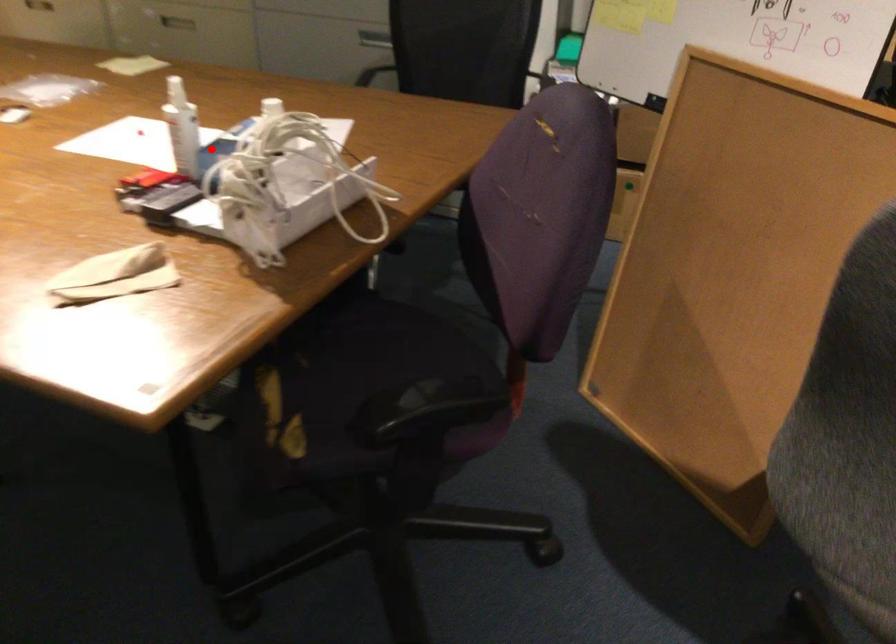
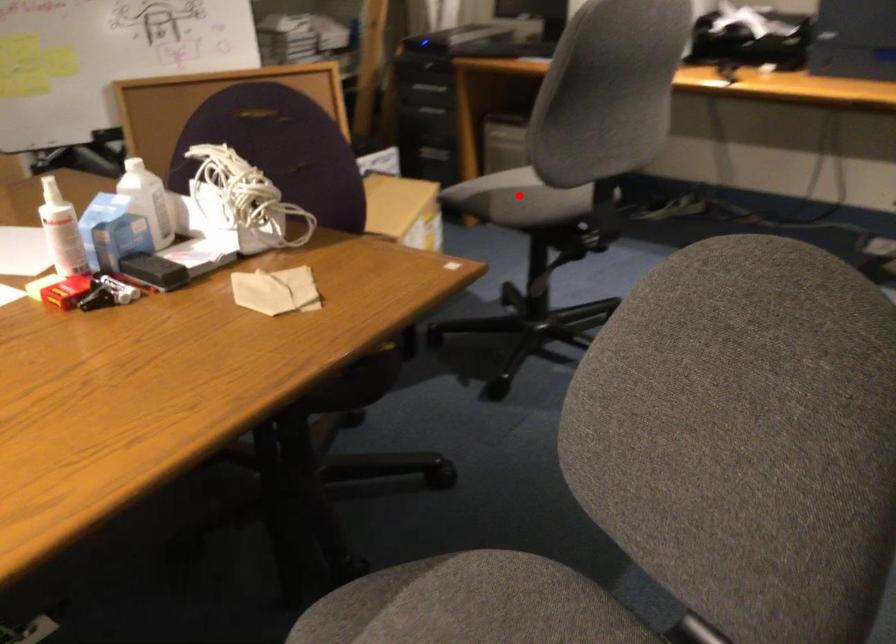
I am providing you with two images of the same scene from different viewpoints. A red point is marked on the first image and another point is marked on the second image. Is the marked point in image1 the same physical position as the marked point in image2?

No